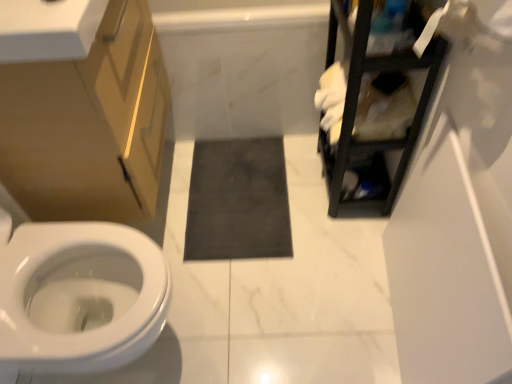
The height and width of the screenshot is (384, 512). I want to click on free space that is in between matte gold cabinet at left and white marble bath at center, so click(241, 188).